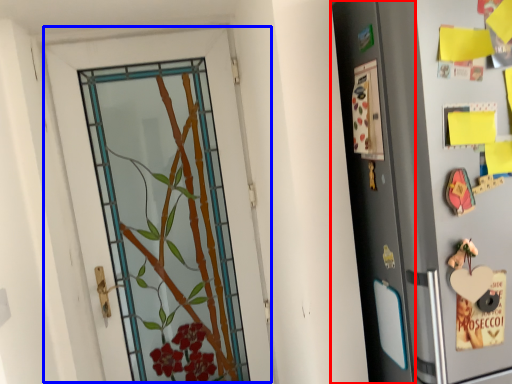
Question: Which point is further to the camera, screen door (highlighted by a red box) or door (highlighted by a blue box)?

Choices:
 (A) screen door
 (B) door

Answer: (B)